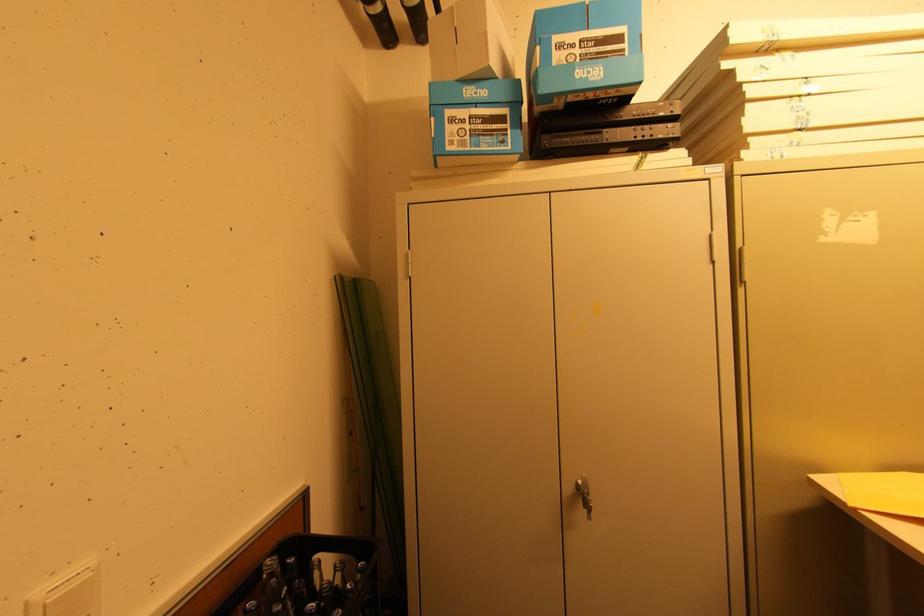
Where is `white light switch`? The width and height of the screenshot is (924, 616). white light switch is located at coordinates (68, 593).